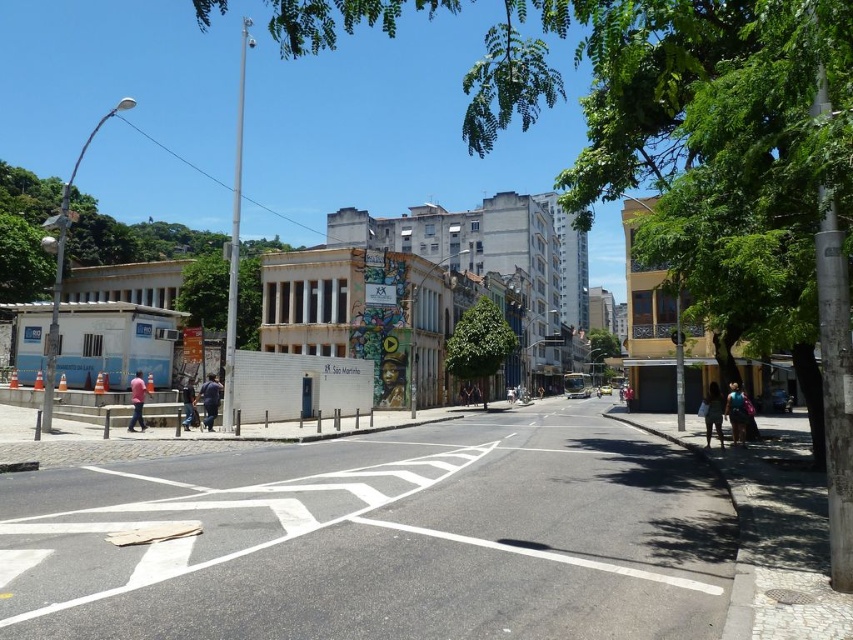
You are a window cleaner standing on the sidewalk. You see the dark blue fabric at center hanging from the building on the left and the pink fabric shirt at lower left hanging from the building on the right. Which fabric is higher up?

The dark blue fabric at center is taller than the pink fabric shirt at lower left, so the dark blue fabric at center is higher up.

From the picture: You are a photographer standing on the street and want to take a photo of both the dark blue jeans at lower center and the red leather jacket at center. Which object should you focus on first to ensure both are in sharp focus?

You should focus on the dark blue jeans at lower center first because it is closer to the viewer than the red leather jacket at center, so adjusting focus from near to far will help both be in sharp focus.